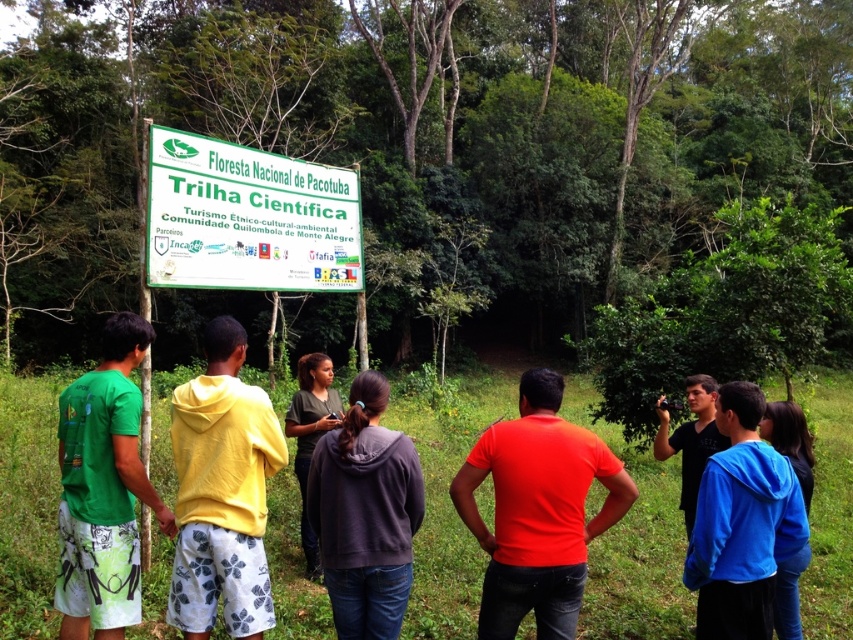
Question: Which point appears farthest from the camera in this image?

Choices:
 (A) (613, 460)
 (B) (212, 515)
 (C) (311, 452)
 (D) (136, 353)

Answer: (C)

Question: Which object appears farthest from the camera in this image?

Choices:
 (A) green plastic sign at center
 (B) dark gray fabric shirt at center
 (C) orange matte t-shirt at center
 (D) blue fleece jacket at center

Answer: (A)

Question: Does green plastic sign at center have a smaller size compared to orange matte t-shirt at center?

Choices:
 (A) no
 (B) yes

Answer: (A)

Question: Is dark gray hoodie at center to the left of black matte shirt at center from the viewer's perspective?

Choices:
 (A) no
 (B) yes

Answer: (B)

Question: Can you confirm if green fabric shorts at center is positioned below dark gray fabric shirt at center?

Choices:
 (A) no
 (B) yes

Answer: (A)

Question: Which of the following is the farthest from the observer?

Choices:
 (A) blue fleece jacket at center
 (B) green fabric shorts at center
 (C) orange matte t-shirt at center

Answer: (B)